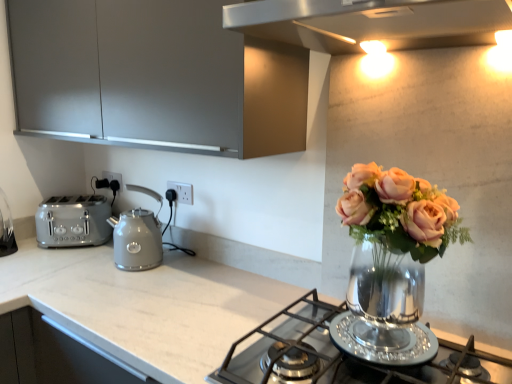
This screenshot has height=384, width=512. I want to click on white plastic electric outlet at center, which is counted as the first electric outlet, starting from the front, so click(182, 191).

Locate an element on the screen. polished stainless steel gas stove at center is located at coordinates (349, 353).

Describe the element at coordinates (393, 251) in the screenshot. This screenshot has width=512, height=384. I see `clear glass vase at center` at that location.

Locate an element on the screen. This screenshot has width=512, height=384. white plastic electric outlet at center, which is counted as the first electric outlet, starting from the front is located at coordinates click(182, 191).

Find the location of a particular element. kettle that appears in front of the satin silver toaster at left is located at coordinates (137, 240).

From the picture: Between matte gray kettle at center and satin silver toaster at left, which one has less height?

satin silver toaster at left is shorter.

Considering the relative positions of matte gray kettle at center and satin silver toaster at left in the image provided, is matte gray kettle at center to the left of satin silver toaster at left from the viewer's perspective?

No, matte gray kettle at center is not to the left of satin silver toaster at left.

Which is farther, (123, 263) or (50, 211)?

Positioned behind is point (50, 211).

Is matte gray cabinet at upper left smaller than white glossy countertop at center?

Yes, matte gray cabinet at upper left is smaller than white glossy countertop at center.

Considering the positions of point (213, 14) and point (146, 343), is point (213, 14) closer or farther from the camera than point (146, 343)?

Point (213, 14) is closer to the camera than point (146, 343).

Which is more to the right, matte gray cabinet at upper left or white glossy countertop at center?

white glossy countertop at center is more to the right.

Can we say white plastic electric outlet at center, which is the second electric outlet from front to back, lies outside white plastic electric outlet at center, arranged as the first electric outlet when viewed from the right?

Indeed, white plastic electric outlet at center, which is the second electric outlet from front to back, is completely outside white plastic electric outlet at center, arranged as the first electric outlet when viewed from the right.

From the image's perspective, is white plastic electric outlet at center, the 2th electric outlet from the right, on top of white plastic electric outlet at center, which is counted as the first electric outlet, starting from the front?

Yes, from the image's perspective, white plastic electric outlet at center, the 2th electric outlet from the right, is over white plastic electric outlet at center, which is counted as the first electric outlet, starting from the front.

Which point is more distant from viewer, (111,177) or (184,188)?

The point (111,177) is more distant.

How different are the orientations of white glossy countertop at center and white plastic electric outlet at center, arranged as the first electric outlet when viewed from the right, in degrees?

The angular difference between white glossy countertop at center and white plastic electric outlet at center, arranged as the first electric outlet when viewed from the right, is 0.907 degrees.

From the image's perspective, is white glossy countertop at center above or below white plastic electric outlet at center, the second electric outlet positioned from the back?

white glossy countertop at center is situated lower than white plastic electric outlet at center, the second electric outlet positioned from the back, in the image.

How much distance is there between white glossy countertop at center and white plastic electric outlet at center, the second electric outlet from the left?

white glossy countertop at center and white plastic electric outlet at center, the second electric outlet from the left, are 20.31 inches apart.

Considering the sizes of white glossy countertop at center and white plastic electric outlet at center, which is counted as the first electric outlet, starting from the front, in the image, is white glossy countertop at center bigger or smaller than white plastic electric outlet at center, which is counted as the first electric outlet, starting from the front,?

Considering their sizes, white glossy countertop at center takes up more space than white plastic electric outlet at center, which is counted as the first electric outlet, starting from the front.

From a real-world perspective, relative to matte gray cabinet at upper left, is white plastic electric outlet at center, the first electric outlet positioned from the back, vertically above or below?

white plastic electric outlet at center, the first electric outlet positioned from the back, is situated lower than matte gray cabinet at upper left in the real world.

Based on the photo, considering the sizes of objects white plastic electric outlet at center, the 2th electric outlet from the right, and matte gray cabinet at upper left in the image provided, who is wider, white plastic electric outlet at center, the 2th electric outlet from the right, or matte gray cabinet at upper left?

Wider between the two is matte gray cabinet at upper left.

Looking at this image, from the image's perspective, which one is positioned higher, white plastic electric outlet at center, which is the second electric outlet from front to back, or matte gray cabinet at upper left?

matte gray cabinet at upper left is shown above in the image.

Would you say white plastic electric outlet at center, which appears as the 1th electric outlet when viewed from the left, contains matte gray cabinet at upper left?

Definitely not — matte gray cabinet at upper left is not inside white plastic electric outlet at center, which appears as the 1th electric outlet when viewed from the left.

From a real-world perspective, is matte gray kettle at center physically above white plastic electric outlet at center, which is counted as the first electric outlet, starting from the front?

No, from a real-world perspective, matte gray kettle at center is not above white plastic electric outlet at center, which is counted as the first electric outlet, starting from the front.

The image size is (512, 384). There is a matte gray kettle at center. Identify the location of the 1st electric outlet above it (from the image's perspective). (182, 191).

From the image's perspective, is matte gray kettle at center above white plastic electric outlet at center, the second electric outlet positioned from the back?

No, from the image's perspective, matte gray kettle at center is not on top of white plastic electric outlet at center, the second electric outlet positioned from the back.

Is white plastic electric outlet at center, which is counted as the first electric outlet, starting from the front, at the back of matte gray cabinet at upper left?

No, matte gray cabinet at upper left's orientation is not away from white plastic electric outlet at center, which is counted as the first electric outlet, starting from the front.

Is point (143, 141) less distant than point (185, 199)?

Yes, point (143, 141) is closer to viewer.

Does matte gray cabinet at upper left have a greater height compared to white plastic electric outlet at center, the second electric outlet positioned from the back?

Correct, matte gray cabinet at upper left is much taller as white plastic electric outlet at center, the second electric outlet positioned from the back.

The height and width of the screenshot is (384, 512). In order to click on toaster to the left of matte gray kettle at center in this screenshot , I will do `click(73, 221)`.

This screenshot has width=512, height=384. Identify the location of countertop in front of the matte gray cabinet at upper left. (144, 305).

Estimate the real-world distances between objects in this image. Which object is further from white glossy countertop at center, clear glass vase at center or white plastic electric outlet at center, the second electric outlet from the left?

Among the two, white plastic electric outlet at center, the second electric outlet from the left, is located further to white glossy countertop at center.

Considering their positions, is clear glass vase at center positioned further to white glossy countertop at center than matte gray cabinet at upper left?

Among the two, matte gray cabinet at upper left is located further to white glossy countertop at center.

Considering their positions, is white plastic electric outlet at center, arranged as the first electric outlet when viewed from the right, positioned closer to white plastic electric outlet at center, the 2th electric outlet from the right, than polished stainless steel gas stove at center?

Based on the image, white plastic electric outlet at center, arranged as the first electric outlet when viewed from the right, appears to be nearer to white plastic electric outlet at center, the 2th electric outlet from the right.

From the image, which object appears to be farther from white plastic electric outlet at center, which is the second electric outlet from front to back, matte gray cabinet at upper left or polished stainless steel gas stove at center?

The object further to white plastic electric outlet at center, which is the second electric outlet from front to back, is polished stainless steel gas stove at center.

Consider the image. Considering their positions, is white glossy countertop at center positioned further to clear glass vase at center than white plastic electric outlet at center, the second electric outlet positioned from the back?

The object further to clear glass vase at center is white plastic electric outlet at center, the second electric outlet positioned from the back.

Based on their spatial positions, is satin silver toaster at left or matte gray kettle at center closer to polished stainless steel gas stove at center?

matte gray kettle at center lies closer to polished stainless steel gas stove at center than the other object.

Based on their spatial positions, is white plastic electric outlet at center, arranged as the first electric outlet when viewed from the right, or polished stainless steel gas stove at center closer to satin silver toaster at left?

Based on the image, white plastic electric outlet at center, arranged as the first electric outlet when viewed from the right, appears to be nearer to satin silver toaster at left.

Which object lies nearer to the anchor point matte gray kettle at center, white plastic electric outlet at center, arranged as the first electric outlet when viewed from the right, or white glossy countertop at center?

white plastic electric outlet at center, arranged as the first electric outlet when viewed from the right, lies closer to matte gray kettle at center than the other object.

Locate an element on the screen. cabinetry between matte gray kettle at center and clear glass vase at center is located at coordinates (155, 77).

Where is `electric outlet between white glossy countertop at center and white plastic electric outlet at center, which is the second electric outlet from front to back, in the front-back direction`? The height and width of the screenshot is (384, 512). electric outlet between white glossy countertop at center and white plastic electric outlet at center, which is the second electric outlet from front to back, in the front-back direction is located at coordinates (182, 191).

The width and height of the screenshot is (512, 384). In order to click on cabinetry between satin silver toaster at left and clear glass vase at center in this screenshot , I will do `click(155, 77)`.

The width and height of the screenshot is (512, 384). Identify the location of kettle between satin silver toaster at left and clear glass vase at center. (137, 240).